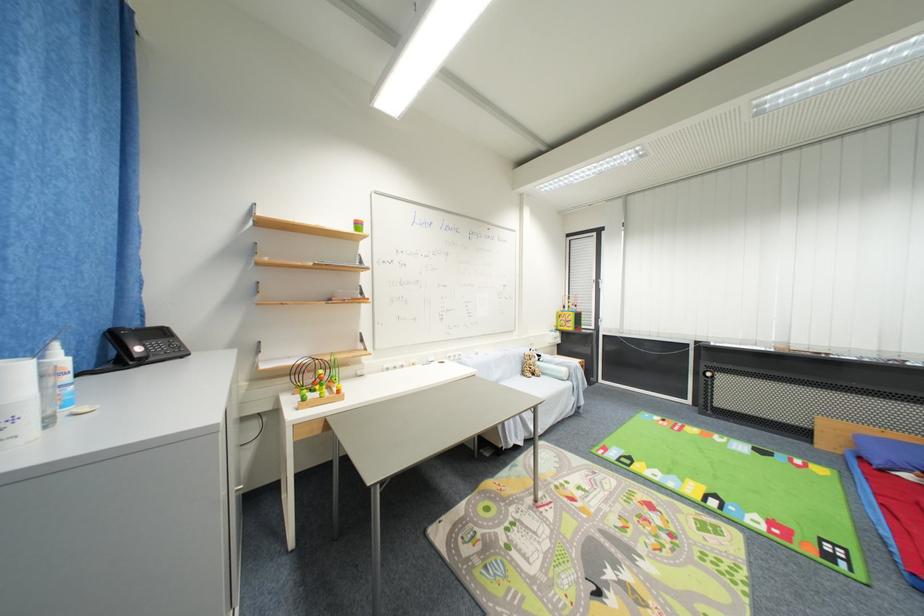
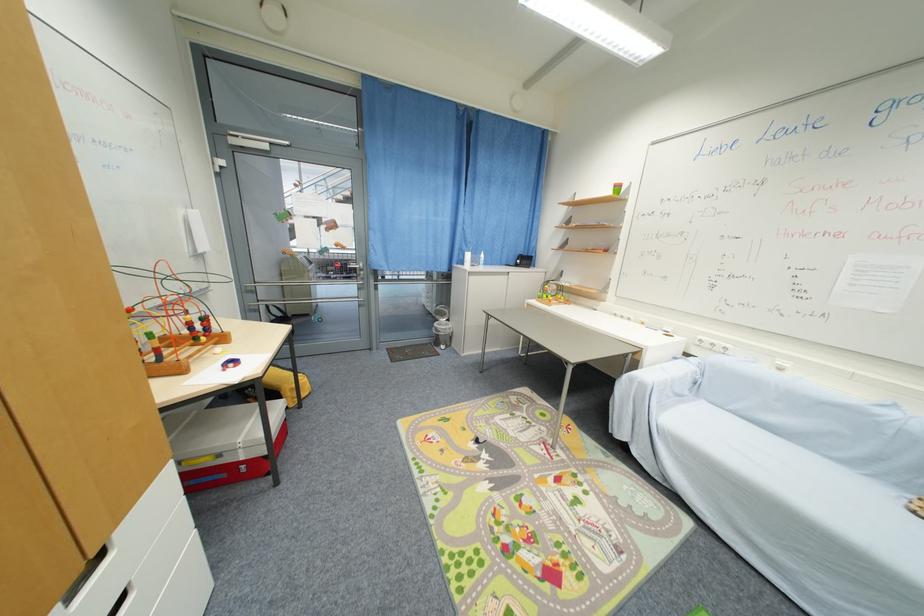
The point at (462, 360) is marked in the first image. Where is the corresponding point in the second image?

(723, 351)